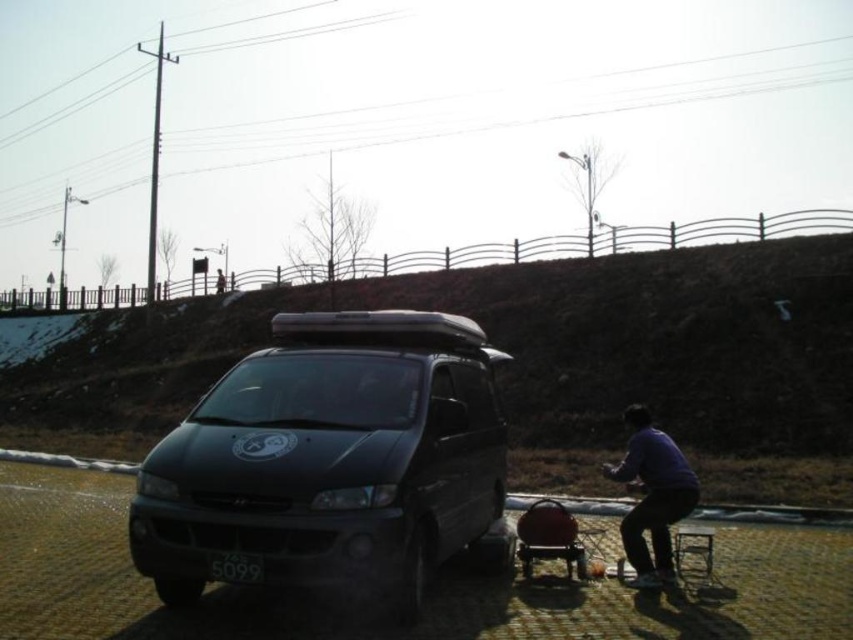
You are a photographer standing in front of the black van parked on the paved surface. You notice the purple matte shirt at lower right and the black plastic license plate at center. Which object is positioned higher up from the ground?

The purple matte shirt at lower right is much taller than the black plastic license plate at center, so the purple matte shirt at lower right is positioned higher up from the ground.

You are a pedestrian standing in front of the black van parked on the paved surface. You notice the purple matte shirt at lower right and the black plastic license plate at center. Which object is positioned more to the east side of the van?

The purple matte shirt at lower right is positioned more to the east side of the van because it is to the right of the black plastic license plate at center, and since the van is parked with its front facing you, the right side would correspond to the east direction if the van is facing north.